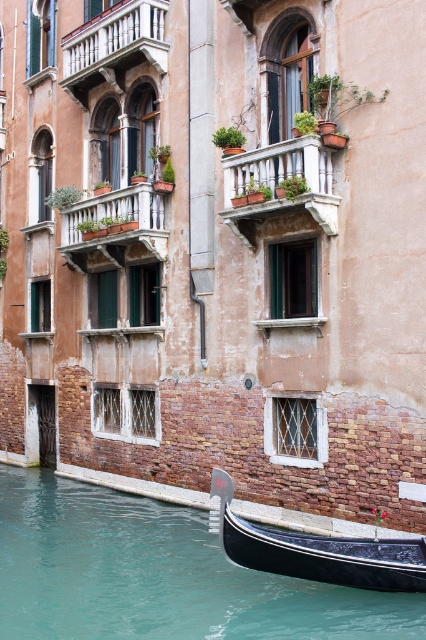
You are a tourist standing on the canal bridge and see the teal glossy water at lower left and the black polished wood gondola at lower right. Which object is positioned to the left side of the other?

The teal glossy water at lower left is positioned to the left of the black polished wood gondola at lower right.

You are standing on the dock and want to board the black polished wood gondola at lower right. Which direction should you walk to reach it from the teal glossy water at lower left?

The black polished wood gondola at lower right is further away from you than the teal glossy water at lower left. To reach the gondola, you should walk towards the lower right direction away from the teal glossy water at lower left.

Looking at this image, you are standing at the point marked as point (158,576) in the image. Looking around, you see the traditional Venetian building with arched windows and balconies. Which direction should you move to reach the teal glossy water at lower left?

The point (158,576) is marked as the teal glossy water at lower left, so you are already at the teal glossy water at lower left.